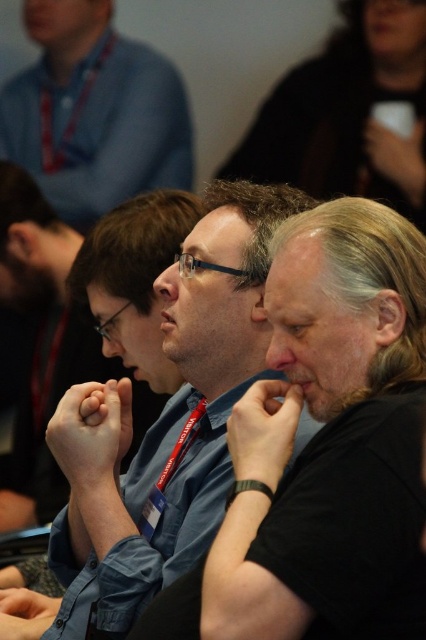
Question: Can you confirm if black matte shirt at center is bigger than gray matte hair at center?

Choices:
 (A) no
 (B) yes

Answer: (A)

Question: Based on their relative distances, which object is nearer to the black matte shirt at center?

Choices:
 (A) gray matte hair at center
 (B) blue shirt at upper left

Answer: (A)

Question: Can you confirm if matte blue shirt at center is smaller than blue shirt at upper left?

Choices:
 (A) no
 (B) yes

Answer: (B)

Question: Which is farther from the gray matte hair at center?

Choices:
 (A) black matte shirt at center
 (B) matte blue shirt at center

Answer: (B)

Question: Considering the real-world distances, which object is closest to the blue shirt at upper left?

Choices:
 (A) matte blue shirt at center
 (B) black matte shirt at center

Answer: (B)

Question: Is blue shirt at upper left positioned before gray matte hair at center?

Choices:
 (A) no
 (B) yes

Answer: (A)